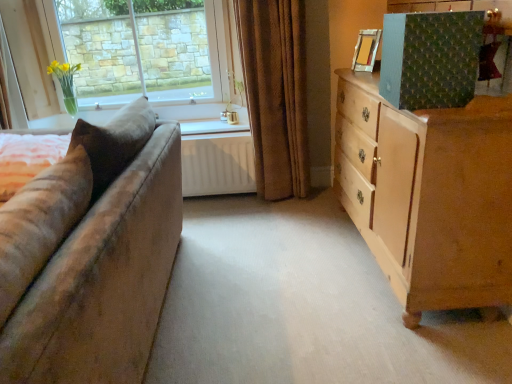
Where is `vacant space to the left of light brown wooden chest of drawers at right`? Image resolution: width=512 pixels, height=384 pixels. vacant space to the left of light brown wooden chest of drawers at right is located at coordinates (276, 268).